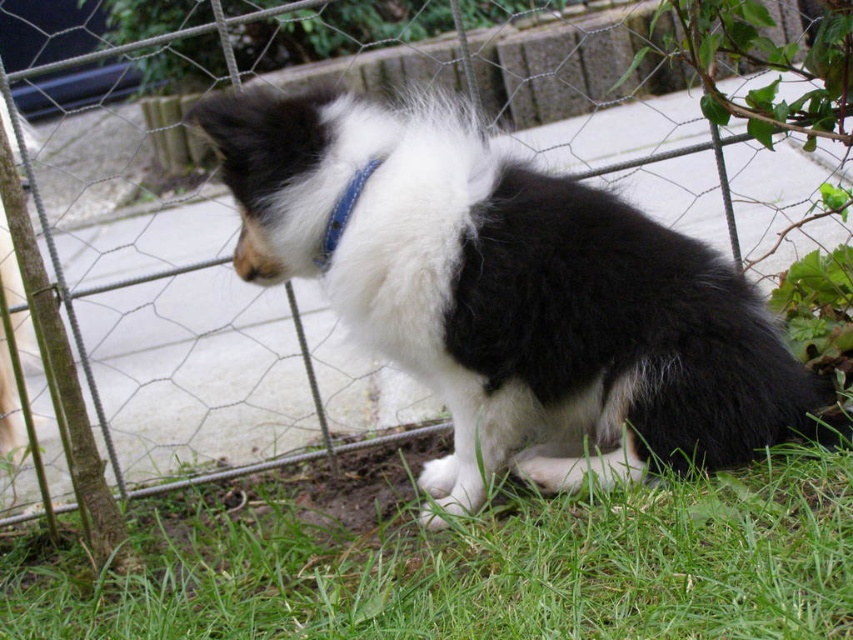
Question: Is black and white fur at center wider than green grass at lower right?

Choices:
 (A) yes
 (B) no

Answer: (B)

Question: Where is black and white fur at center located in relation to green grass at lower right in the image?

Choices:
 (A) left
 (B) right

Answer: (B)

Question: Among these objects, which one is farthest from the camera?

Choices:
 (A) blue leather neckband at center
 (B) black and white fur at center
 (C) green grass at lower right

Answer: (A)

Question: Which of the following is the farthest from the observer?

Choices:
 (A) (323, 260)
 (B) (206, 112)

Answer: (A)

Question: Which object appears closest to the camera in this image?

Choices:
 (A) green grass at lower right
 (B) blue leather neckband at center
 (C) black and white fur at center

Answer: (A)

Question: In this image, where is black and white fur at center located relative to green grass at lower right?

Choices:
 (A) right
 (B) left

Answer: (A)